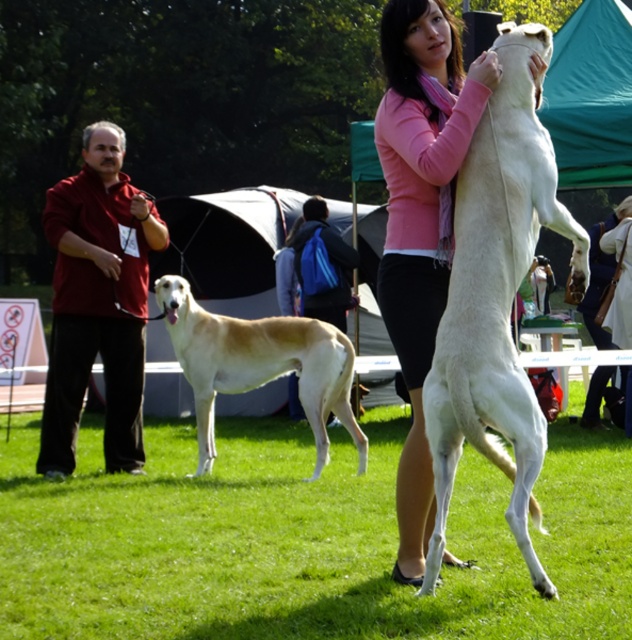
You are a judge at a dog show and need to determine which of the two dogs in the center is taller. The dogs are the white smooth dog at center and the light beige fur at center. Based on the description, which one is taller?

The white smooth dog at center is much taller than the light beige fur at center.

You are a photographer at the dog show and need to position a spotlight exactly at the center of the white smooth dog at center. According to the coordinates provided, where should you aim the spotlight?

The spotlight should be aimed at the coordinates point (495, 300) where the white smooth dog at center is located.